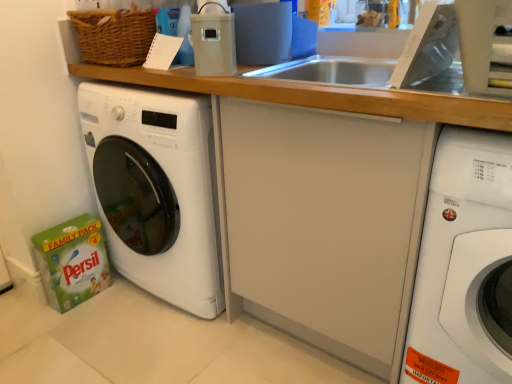
Question: From a real-world perspective, is matte plastic container at upper center physically above white glossy washing machine at right, positioned as the first washing machine in right-to-left order?

Choices:
 (A) yes
 (B) no

Answer: (A)

Question: Is matte plastic container at upper center thinner than white glossy washing machine at right, acting as the 2th washing machine starting from the left?

Choices:
 (A) yes
 (B) no

Answer: (A)

Question: Is white glossy washing machine at right, acting as the 2th washing machine starting from the left, a part of matte plastic container at upper center?

Choices:
 (A) no
 (B) yes

Answer: (A)

Question: Does matte plastic container at upper center have a larger size compared to white glossy washing machine at right, acting as the 2th washing machine starting from the left?

Choices:
 (A) yes
 (B) no

Answer: (B)

Question: Is white glossy washing machine at right, acting as the 2th washing machine starting from the left, at the back of matte plastic container at upper center?

Choices:
 (A) no
 (B) yes

Answer: (A)

Question: Is point (236, 64) closer or farther from the camera than point (192, 134)?

Choices:
 (A) farther
 (B) closer

Answer: (A)

Question: Looking at the image, does matte plastic container at upper center seem bigger or smaller compared to white glossy washing machine at left, the second washing machine when ordered from right to left?

Choices:
 (A) small
 (B) big

Answer: (A)

Question: From the image's perspective, is matte plastic container at upper center above or below white glossy washing machine at left, the second washing machine when ordered from right to left?

Choices:
 (A) above
 (B) below

Answer: (A)

Question: In the image, is matte plastic container at upper center on the left side or the right side of white glossy washing machine at left, which is the first washing machine in left-to-right order?

Choices:
 (A) right
 (B) left

Answer: (A)

Question: Visually, is white glossy washing machine at left, which is the first washing machine in left-to-right order, positioned to the left or to the right of matte plastic container at upper center?

Choices:
 (A) right
 (B) left

Answer: (B)

Question: Is white glossy washing machine at left, the second washing machine when ordered from right to left, inside the boundaries of matte plastic container at upper center, or outside?

Choices:
 (A) outside
 (B) inside

Answer: (A)

Question: In the image, is white glossy washing machine at left, which is the first washing machine in left-to-right order, positioned in front of or behind matte plastic container at upper center?

Choices:
 (A) behind
 (B) front

Answer: (A)

Question: Based on their sizes in the image, would you say white glossy washing machine at left, which is the first washing machine in left-to-right order, is bigger or smaller than matte plastic container at upper center?

Choices:
 (A) small
 (B) big

Answer: (B)

Question: Does point (497, 178) appear closer or farther from the camera than point (84, 84)?

Choices:
 (A) farther
 (B) closer

Answer: (B)

Question: From a real-world perspective, relative to white glossy washing machine at left, the second washing machine when ordered from right to left, is white glossy washing machine at right, acting as the 2th washing machine starting from the left, vertically above or below?

Choices:
 (A) below
 (B) above

Answer: (A)